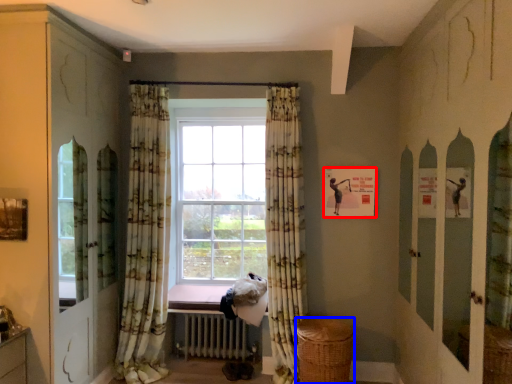
Question: Which of the following is the closest to the observer, picture frame (highlighted by a red box) or basket (highlighted by a blue box)?

Choices:
 (A) picture frame
 (B) basket

Answer: (B)